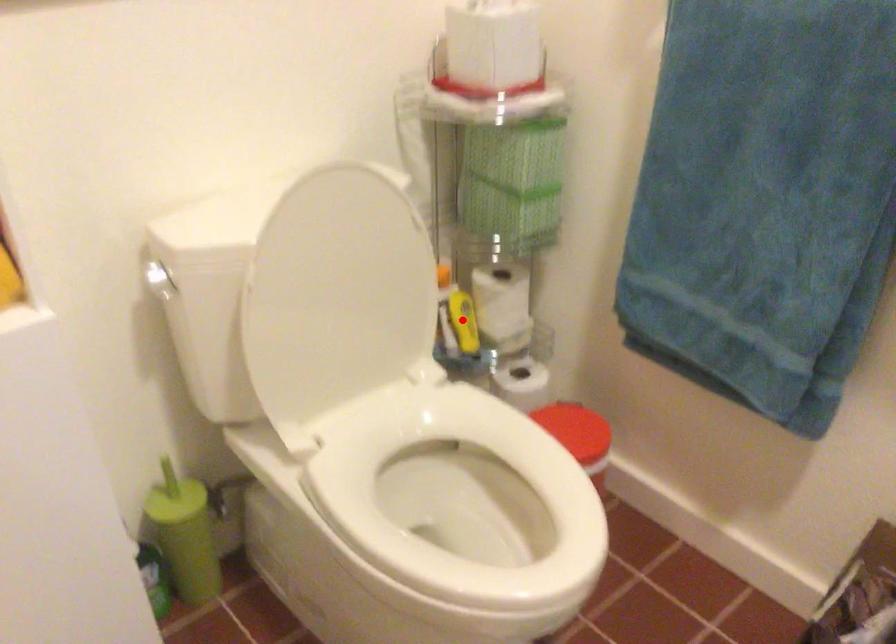
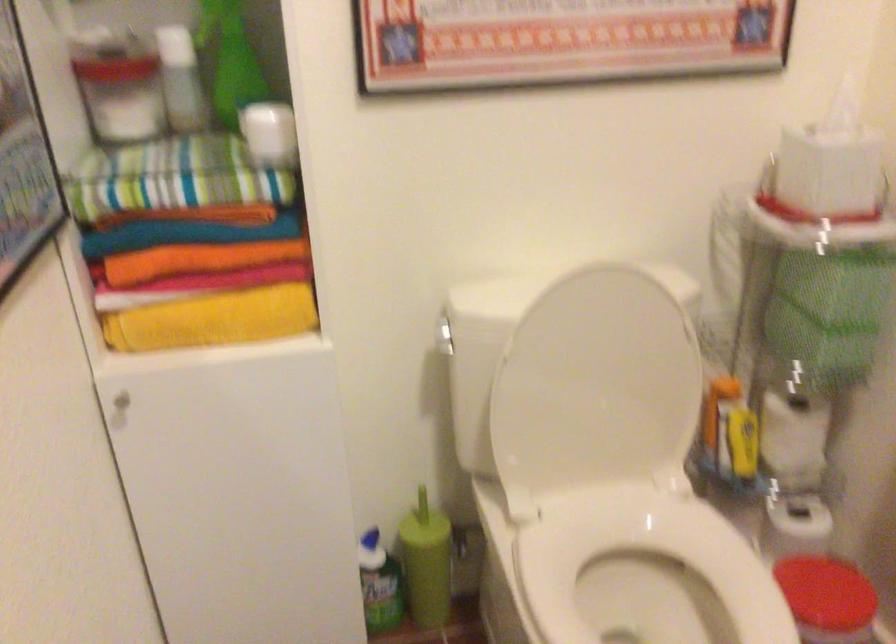
The point at the highlighted location is marked in the first image. Where is the corresponding point in the second image?

(743, 440)